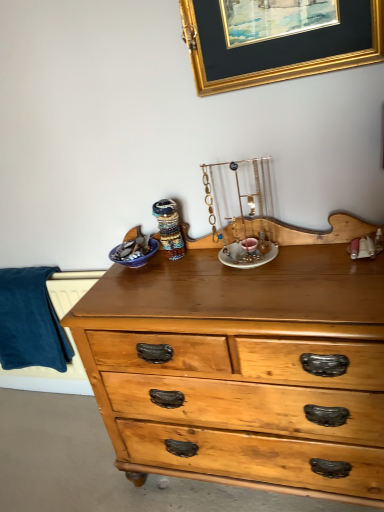
Question: Considering their positions, is gold/glossy picture frame at upper center located in front of or behind blue soft fabric at left?

Choices:
 (A) front
 (B) behind

Answer: (A)

Question: Is gold/glossy picture frame at upper center wider or thinner than blue soft fabric at left?

Choices:
 (A) thin
 (B) wide

Answer: (A)

Question: From the image's perspective, is gold/glossy picture frame at upper center above or below blue soft fabric at left?

Choices:
 (A) above
 (B) below

Answer: (A)

Question: From their relative heights in the image, would you say blue soft fabric at left is taller or shorter than gold/glossy picture frame at upper center?

Choices:
 (A) short
 (B) tall

Answer: (B)

Question: Do you think blue soft fabric at left is within gold/glossy picture frame at upper center, or outside of it?

Choices:
 (A) inside
 (B) outside

Answer: (B)

Question: Is blue soft fabric at left bigger or smaller than gold/glossy picture frame at upper center?

Choices:
 (A) small
 (B) big

Answer: (B)

Question: Considering their positions, is blue soft fabric at left located in front of or behind gold/glossy picture frame at upper center?

Choices:
 (A) front
 (B) behind

Answer: (B)